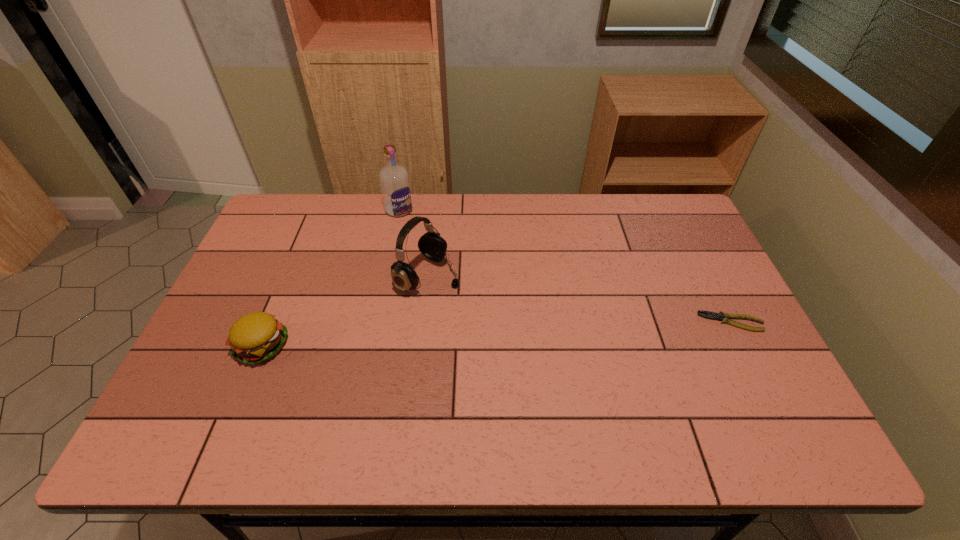
This screenshot has width=960, height=540. Identify the location of vacant region between the hamburger and the pliers. (497, 334).

The image size is (960, 540). In order to click on unoccupied area between the pliers and the farthest object in this screenshot , I will do `click(565, 266)`.

I want to click on free area in between the third nearest object and the farthest object, so click(414, 243).

Locate an element on the screen. object that is the third closest to the third shortest object is located at coordinates (721, 316).

You are a GUI agent. You are given a task and a screenshot of the screen. Output one action in this format:
    pyautogui.click(x=<x>, y=<y>)
    Task: Click on the second closest object to the rightmost object
    This screenshot has height=540, width=960.
    Given the screenshot: What is the action you would take?
    pyautogui.click(x=394, y=180)

Locate an element on the screen. The height and width of the screenshot is (540, 960). free location that satisfies the following two spatial constraints: 1. on the front side of the farthest object; 2. on the right side of the shortest object is located at coordinates (376, 322).

The image size is (960, 540). I want to click on free spot that satisfies the following two spatial constraints: 1. on the front side of the pliers; 2. on the left side of the vodka, so click(x=376, y=322).

This screenshot has width=960, height=540. I want to click on vacant area in the image that satisfies the following two spatial constraints: 1. on the front side of the rightmost object; 2. on the right side of the farthest object, so click(376, 322).